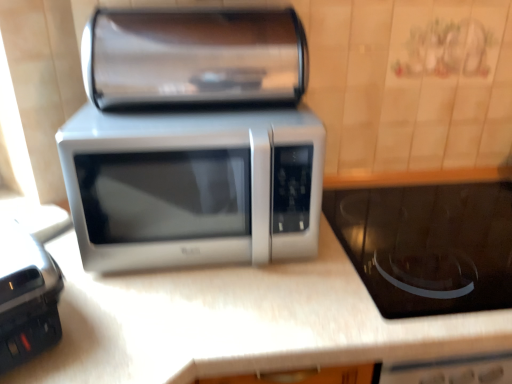
Describe the element at coordinates (26, 296) in the screenshot. I see `black plastic toaster at lower left, which ranks as the 2th appliance in right-to-left order` at that location.

Describe the element at coordinates (238, 322) in the screenshot. The height and width of the screenshot is (384, 512). I see `white laminate counter at center` at that location.

Identify the location of satin silver microwave at center. The image size is (512, 384). (194, 57).

This screenshot has height=384, width=512. What do you see at coordinates (193, 186) in the screenshot?
I see `satin silver microwave at center` at bounding box center [193, 186].

The image size is (512, 384). Find the location of `black glass cooktop at center, marked as the second appliance in a left-to-right arrangement`. black glass cooktop at center, marked as the second appliance in a left-to-right arrangement is located at coordinates click(428, 245).

At what (x,y) coordinates should I click in order to perform the action: click on black plastic toaster at lower left, the 1th appliance positioned from the left. Please return your answer as a coordinate pair (x, y). This screenshot has height=384, width=512. Looking at the image, I should click on (26, 296).

Can you confirm if satin silver microwave at center is taller than black glass cooktop at center, which is the 1th appliance in right-to-left order?

Yes, satin silver microwave at center is taller than black glass cooktop at center, which is the 1th appliance in right-to-left order.

Is satin silver microwave at center far away from black glass cooktop at center, which is the 1th appliance in right-to-left order?

Actually, satin silver microwave at center and black glass cooktop at center, which is the 1th appliance in right-to-left order, are a little close together.

Image resolution: width=512 pixels, height=384 pixels. I want to click on appliance on the right of satin silver microwave at center, so click(428, 245).

Can we say satin silver microwave at center lies outside black glass cooktop at center, marked as the second appliance in a left-to-right arrangement?

satin silver microwave at center is positioned outside black glass cooktop at center, marked as the second appliance in a left-to-right arrangement.

Where is `counter top in front of the satin silver microwave at center`? counter top in front of the satin silver microwave at center is located at coordinates (238, 322).

Which object is positioned more to the left, white laminate counter at center or satin silver microwave at center?

From the viewer's perspective, satin silver microwave at center appears more on the left side.

Based on the photo, looking at their sizes, would you say white laminate counter at center is wider or thinner than satin silver microwave at center?

Clearly, white laminate counter at center has more width compared to satin silver microwave at center.

Which object is further away from the camera taking this photo, black glass cooktop at center, which is the 1th appliance in right-to-left order, or satin silver microwave at center?

black glass cooktop at center, which is the 1th appliance in right-to-left order, is further from the camera.

Between black glass cooktop at center, which is the 1th appliance in right-to-left order, and satin silver microwave at center, which one has smaller width?

With smaller width is satin silver microwave at center.

From the picture: Considering the sizes of objects black glass cooktop at center, which is the 1th appliance in right-to-left order, and satin silver microwave at center in the image provided, who is smaller, black glass cooktop at center, which is the 1th appliance in right-to-left order, or satin silver microwave at center?

Smaller between the two is black glass cooktop at center, which is the 1th appliance in right-to-left order.

Is black glass cooktop at center, which is the 1th appliance in right-to-left order, not inside satin silver microwave at center?

Yes, black glass cooktop at center, which is the 1th appliance in right-to-left order, is outside of satin silver microwave at center.

Is satin silver microwave at center placed right next to white laminate counter at center?

satin silver microwave at center and white laminate counter at center are not in contact.

From the image's perspective, would you say satin silver microwave at center is shown under white laminate counter at center?

No, from the image's perspective, satin silver microwave at center is not below white laminate counter at center.

Identify the location of stereo above the white laminate counter at center (from the image's perspective). (194, 57).

Considering the positions of objects satin silver microwave at center and white laminate counter at center in the image provided, who is in front, satin silver microwave at center or white laminate counter at center?

white laminate counter at center is more forward.

In the scene shown: Is satin silver microwave at center a part of black plastic toaster at lower left, which ranks as the 2th appliance in right-to-left order?

No, satin silver microwave at center is located outside of black plastic toaster at lower left, which ranks as the 2th appliance in right-to-left order.

Which of these two, black plastic toaster at lower left, the 1th appliance positioned from the left, or satin silver microwave at center, is wider?

satin silver microwave at center is wider.

Based on the photo, from a real-world perspective, is black plastic toaster at lower left, which ranks as the 2th appliance in right-to-left order, above or below satin silver microwave at center?

In terms of real-world spatial position, black plastic toaster at lower left, which ranks as the 2th appliance in right-to-left order, is below satin silver microwave at center.

Is black plastic toaster at lower left, the 1th appliance positioned from the left, looking in the opposite direction of satin silver microwave at center?

No, black plastic toaster at lower left, the 1th appliance positioned from the left,'s orientation is not away from satin silver microwave at center.

Consider the image. What's the angular difference between white laminate counter at center and black glass cooktop at center, which is the 1th appliance in right-to-left order,'s facing directions?

The angular difference between white laminate counter at center and black glass cooktop at center, which is the 1th appliance in right-to-left order, is 0.0368 degrees.

Where is `counter top on the left of black glass cooktop at center, marked as the second appliance in a left-to-right arrangement`? Image resolution: width=512 pixels, height=384 pixels. counter top on the left of black glass cooktop at center, marked as the second appliance in a left-to-right arrangement is located at coordinates (238, 322).

Considering the relative positions of white laminate counter at center and black glass cooktop at center, marked as the second appliance in a left-to-right arrangement, in the image provided, is white laminate counter at center to the right of black glass cooktop at center, marked as the second appliance in a left-to-right arrangement, from the viewer's perspective?

No, white laminate counter at center is not to the right of black glass cooktop at center, marked as the second appliance in a left-to-right arrangement.

Which is behind, white laminate counter at center or black glass cooktop at center, marked as the second appliance in a left-to-right arrangement?

black glass cooktop at center, marked as the second appliance in a left-to-right arrangement, is more distant.

Is satin silver microwave at center wider or thinner than satin silver microwave at center?

In the image, satin silver microwave at center appears to be wider than satin silver microwave at center.

Looking at this image, considering the sizes of satin silver microwave at center and satin silver microwave at center in the image, is satin silver microwave at center taller or shorter than satin silver microwave at center?

In the image, satin silver microwave at center appears to be taller than satin silver microwave at center.

Looking at this image, visually, is satin silver microwave at center positioned to the left or to the right of satin silver microwave at center?

Based on their positions, satin silver microwave at center is located to the right of satin silver microwave at center.

From a real-world perspective, is satin silver microwave at center below satin silver microwave at center?

Indeed, from a real-world perspective, satin silver microwave at center is positioned beneath satin silver microwave at center.

Find the location of a particular element. This screenshot has height=384, width=512. microwave oven to the left of black glass cooktop at center, which is the 1th appliance in right-to-left order is located at coordinates (193, 186).

Where is `counter top that appears below the satin silver microwave at center (from the image's perspective)`? The height and width of the screenshot is (384, 512). counter top that appears below the satin silver microwave at center (from the image's perspective) is located at coordinates (238, 322).

Estimate the real-world distances between objects in this image. Which object is further from black glass cooktop at center, marked as the second appliance in a left-to-right arrangement, satin silver microwave at center or white laminate counter at center?

Based on the image, satin silver microwave at center appears to be further to black glass cooktop at center, marked as the second appliance in a left-to-right arrangement.

From the picture: Considering their positions, is satin silver microwave at center positioned closer to white laminate counter at center than black plastic toaster at lower left, the 1th appliance positioned from the left?

black plastic toaster at lower left, the 1th appliance positioned from the left, is closer to white laminate counter at center.

When comparing their distances from black plastic toaster at lower left, which ranks as the 2th appliance in right-to-left order, does satin silver microwave at center or black glass cooktop at center, marked as the second appliance in a left-to-right arrangement, seem further?

The object further to black plastic toaster at lower left, which ranks as the 2th appliance in right-to-left order, is black glass cooktop at center, marked as the second appliance in a left-to-right arrangement.

Based on their spatial positions, is satin silver microwave at center or white laminate counter at center further from satin silver microwave at center?

white laminate counter at center lies further to satin silver microwave at center than the other object.

Looking at the image, which one is located further to satin silver microwave at center, black plastic toaster at lower left, the 1th appliance positioned from the left, or satin silver microwave at center?

black plastic toaster at lower left, the 1th appliance positioned from the left, is further to satin silver microwave at center.

When comparing their distances from satin silver microwave at center, does black glass cooktop at center, marked as the second appliance in a left-to-right arrangement, or black plastic toaster at lower left, which ranks as the 2th appliance in right-to-left order, seem further?

The object further to satin silver microwave at center is black glass cooktop at center, marked as the second appliance in a left-to-right arrangement.

When comparing their distances from black plastic toaster at lower left, which ranks as the 2th appliance in right-to-left order, does satin silver microwave at center or satin silver microwave at center seem closer?

Based on the image, satin silver microwave at center appears to be nearer to black plastic toaster at lower left, which ranks as the 2th appliance in right-to-left order.

Estimate the real-world distances between objects in this image. Which object is closer to black plastic toaster at lower left, the 1th appliance positioned from the left, white laminate counter at center or satin silver microwave at center?

white laminate counter at center lies closer to black plastic toaster at lower left, the 1th appliance positioned from the left, than the other object.

Image resolution: width=512 pixels, height=384 pixels. In order to click on microwave oven between satin silver microwave at center and white laminate counter at center from top to bottom in this screenshot , I will do (193, 186).

Where is `stereo between black plastic toaster at lower left, the 1th appliance positioned from the left, and black glass cooktop at center, marked as the second appliance in a left-to-right arrangement`? The image size is (512, 384). stereo between black plastic toaster at lower left, the 1th appliance positioned from the left, and black glass cooktop at center, marked as the second appliance in a left-to-right arrangement is located at coordinates (194, 57).

Locate an element on the screen. This screenshot has height=384, width=512. microwave oven between satin silver microwave at center and black plastic toaster at lower left, the 1th appliance positioned from the left, in the up-down direction is located at coordinates (193, 186).

Where is `microwave oven between black plastic toaster at lower left, which ranks as the 2th appliance in right-to-left order, and black glass cooktop at center, which is the 1th appliance in right-to-left order, in the horizontal direction`? microwave oven between black plastic toaster at lower left, which ranks as the 2th appliance in right-to-left order, and black glass cooktop at center, which is the 1th appliance in right-to-left order, in the horizontal direction is located at coordinates (193, 186).